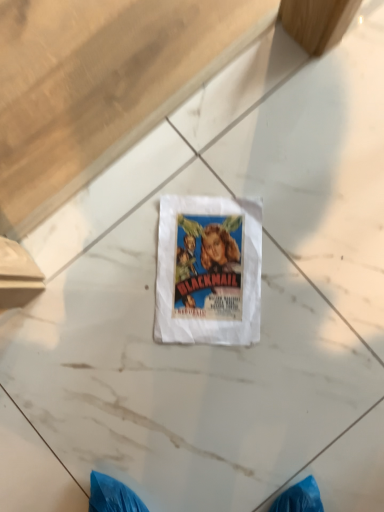
Find the location of a particular element. Image resolution: width=384 pixels, height=512 pixels. free space in front of colorful paper poster at center is located at coordinates (257, 376).